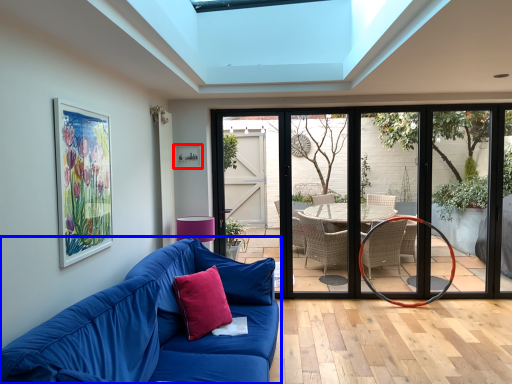
Question: Which point is further to the camera, picture frame (highlighted by a red box) or studio couch (highlighted by a blue box)?

Choices:
 (A) picture frame
 (B) studio couch

Answer: (A)